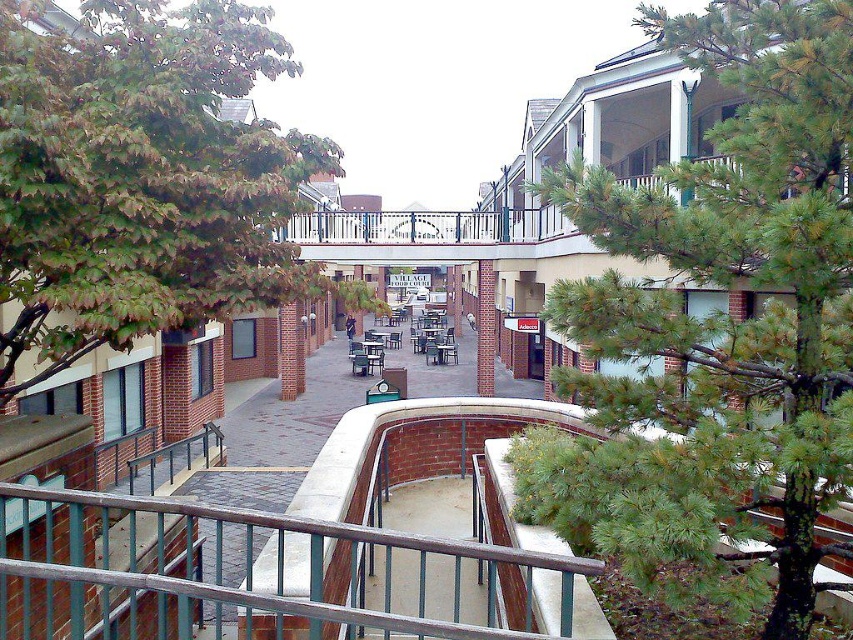
Can you confirm if green pine tree at upper right is positioned above green leafy tree at left?

Incorrect, green pine tree at upper right is not positioned above green leafy tree at left.

Is point (698, 529) behind point (236, 61)?

That is False.

Locate an element on the screen. The image size is (853, 640). green pine tree at upper right is located at coordinates (718, 326).

Can you confirm if green leafy tree at left is positioned above metallic gray railing at center?

Indeed, green leafy tree at left is positioned over metallic gray railing at center.

Who is higher up, green leafy tree at left or metallic gray railing at center?

Positioned higher is green leafy tree at left.

What do you see at coordinates (142, 177) in the screenshot?
I see `green leafy tree at left` at bounding box center [142, 177].

Where is `green leafy tree at left`? The height and width of the screenshot is (640, 853). green leafy tree at left is located at coordinates (142, 177).

Can you confirm if green pine tree at upper right is positioned below metallic gray railing at center?

Incorrect, green pine tree at upper right is not positioned below metallic gray railing at center.

In the scene shown: Is green pine tree at upper right bigger than metallic gray railing at center?

Correct, green pine tree at upper right is larger in size than metallic gray railing at center.

Is point (741, 205) positioned behind point (3, 586)?

That is True.

Locate an element on the screen. green pine tree at upper right is located at coordinates (718, 326).